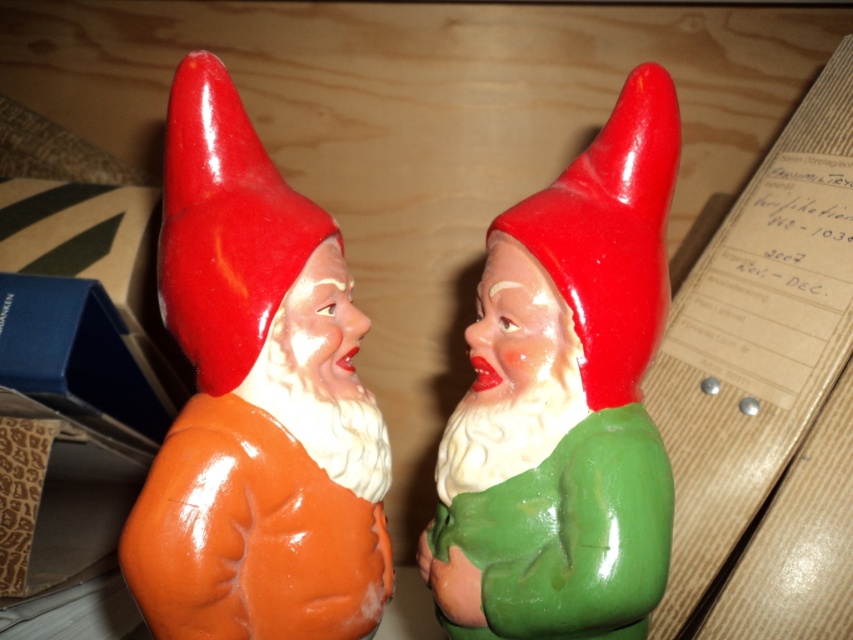
You are standing in front of the two gnome figurines. The scene has a matte orange statue at left and another gnome on the right. Based on their positions, which gnome is closer to the edge of the wooden surface?

The matte orange statue at left is closer to the edge of the wooden surface because its 2D location at point (256, 401) places it nearer to the edge compared to the other gnome.

You are a child trying to reach both the matte orange statue at left and the green glossy gnome at center from your current position. Which gnome figurine can you grab first without moving your hand?

The matte orange statue at left is closer to the viewer than the green glossy gnome at center, so you can grab the matte orange statue at left first without moving your hand.